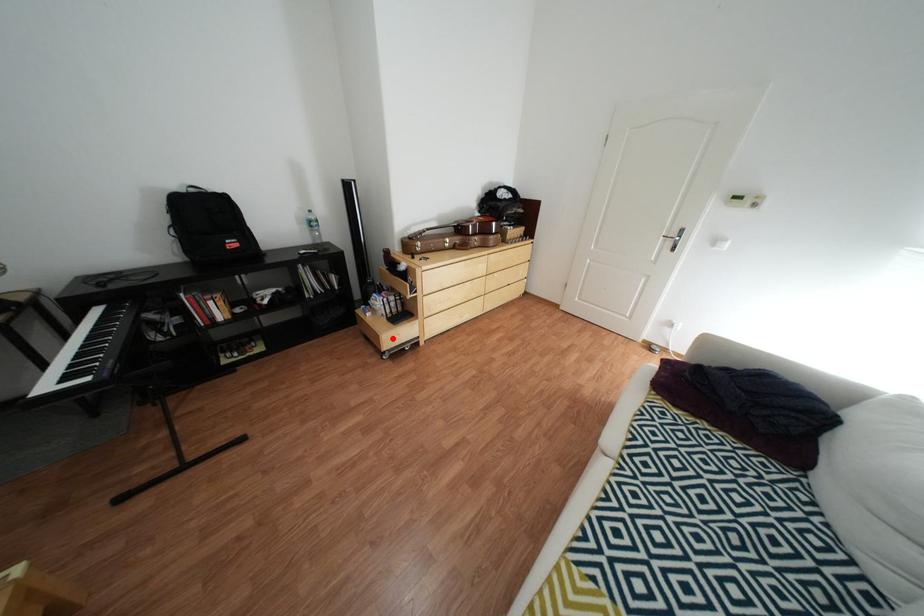
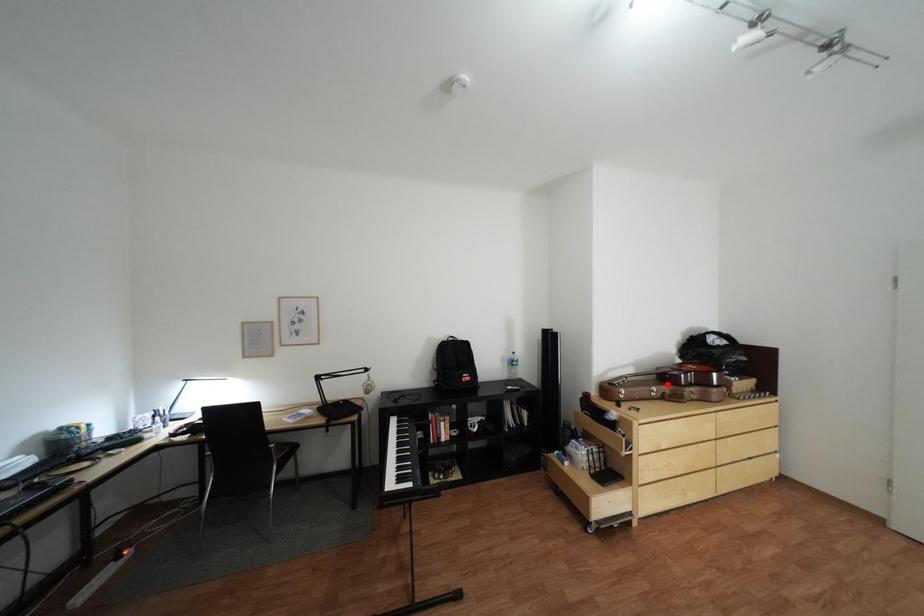
I am providing you with two images of the same scene from different viewpoints. A red point is marked on the first image and another point is marked on the second image. Do the highlighted points in image1 and image2 indicate the same real-world spot?

No